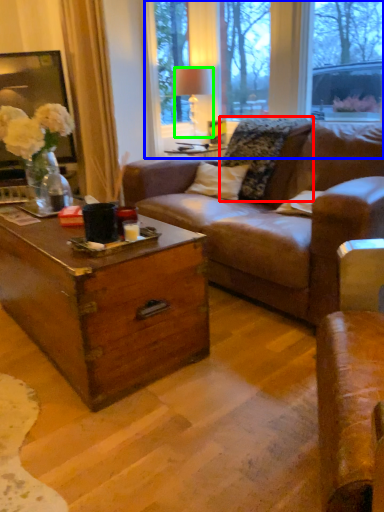
Question: Based on their relative distances, which object is farther from pillow (highlighted by a red box)? Choose from bay window (highlighted by a blue box) and lamp (highlighted by a green box).

Choices:
 (A) bay window
 (B) lamp

Answer: (A)